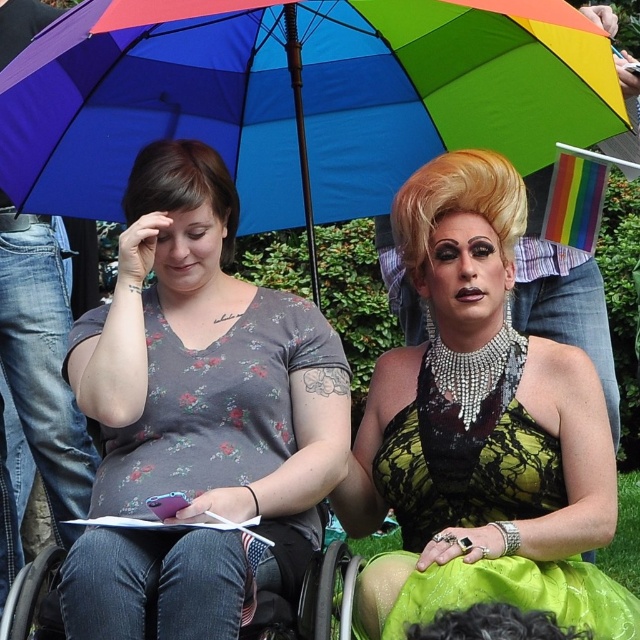
Which is below, floral printed shirt at center or black plastic wheelchair at lower center?

black plastic wheelchair at lower center

Which is behind, point (262, 456) or point (280, 634)?

The point (262, 456) is behind.

The width and height of the screenshot is (640, 640). I want to click on floral printed shirt at center, so click(209, 369).

Based on the photo, can you confirm if rainbow fabric umbrella at upper center is bigger than green satin dress at center?

Indeed, rainbow fabric umbrella at upper center has a larger size compared to green satin dress at center.

Can you confirm if rainbow fabric umbrella at upper center is positioned to the right of green satin dress at center?

No, rainbow fabric umbrella at upper center is not to the right of green satin dress at center.

I want to click on rainbow fabric umbrella at upper center, so click(294, 97).

Where is `rainbow fabric umbrella at upper center`? This screenshot has width=640, height=640. rainbow fabric umbrella at upper center is located at coordinates (294, 97).

Identify the location of rainbow fabric umbrella at upper center. Image resolution: width=640 pixels, height=640 pixels. (294, 97).

Who is higher up, rainbow fabric umbrella at upper center or black plastic wheelchair at lower center?

rainbow fabric umbrella at upper center is higher up.

Identify the location of rainbow fabric umbrella at upper center. Image resolution: width=640 pixels, height=640 pixels. (294, 97).

You are a GUI agent. You are given a task and a screenshot of the screen. Output one action in this format:
    pyautogui.click(x=<x>, y=<y>)
    Task: Click on the rainbow fabric umbrella at upper center
    The height and width of the screenshot is (640, 640).
    Given the screenshot: What is the action you would take?
    pyautogui.click(x=294, y=97)